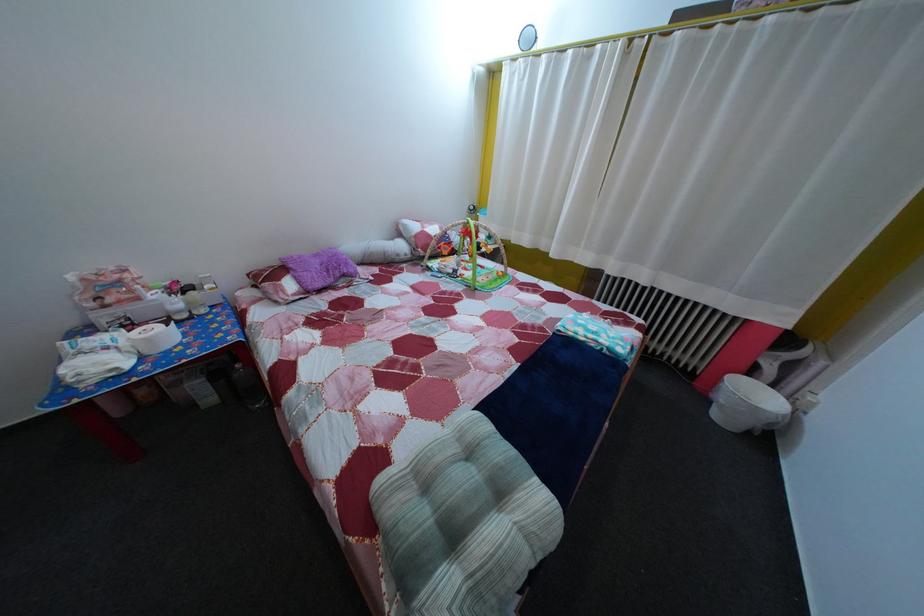
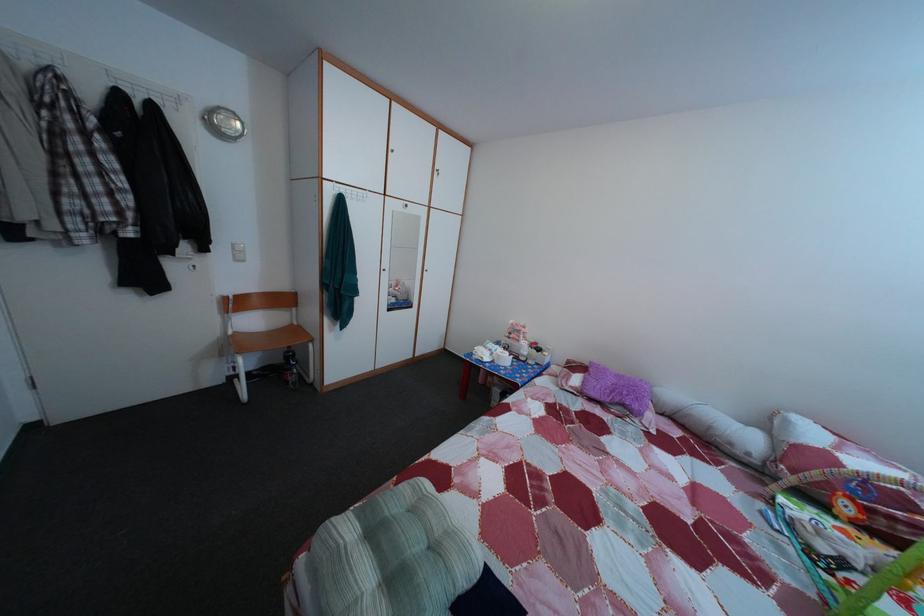
Where in the second image is the point corresponding to the point at 351,288 from the first image?

(628, 416)